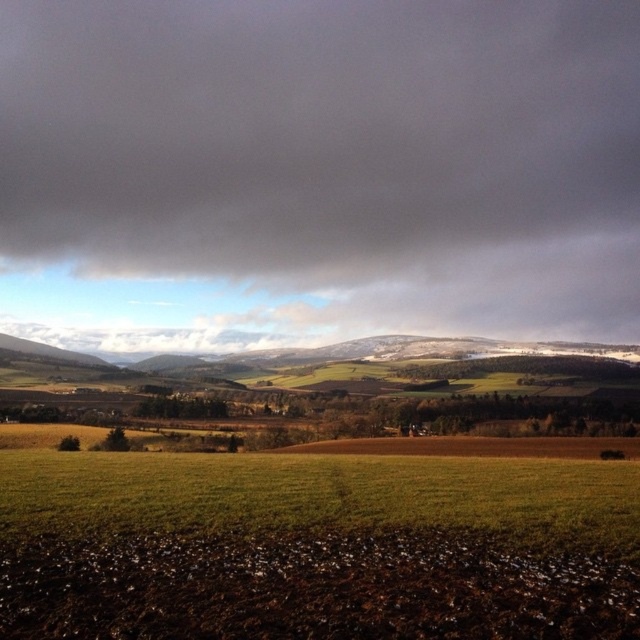
Identify the location of dark gray cloud at upper center. The height and width of the screenshot is (640, 640). (317, 170).

Locate an element on the screen. dark gray cloud at upper center is located at coordinates (317, 170).